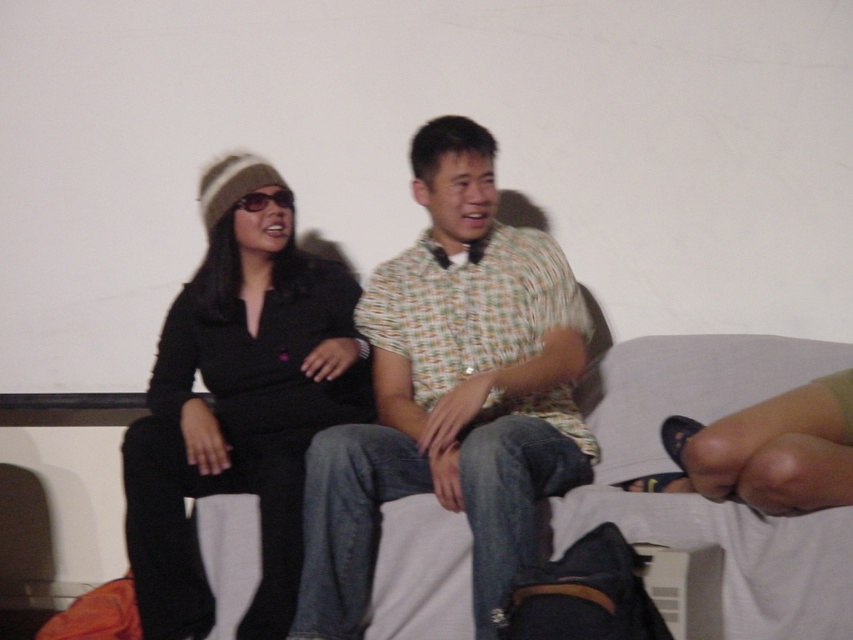
Between checkered fabric shirt at center and black matte shirt at left, which one appears on the left side from the viewer's perspective?

From the viewer's perspective, black matte shirt at left appears more on the left side.

Find the location of `checkered fabric shirt at center`. checkered fabric shirt at center is located at coordinates (451, 392).

Does point (543, 476) come farther from viewer compared to point (204, 477)?

No.

Identify the location of checkered fabric shirt at center. (451, 392).